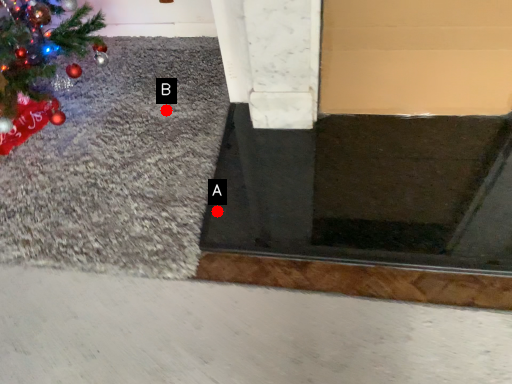
Question: Two points are circled on the image, labeled by A and B beside each circle. Which point appears closest to the camera in this image?

Choices:
 (A) A is closer
 (B) B is closer

Answer: (A)